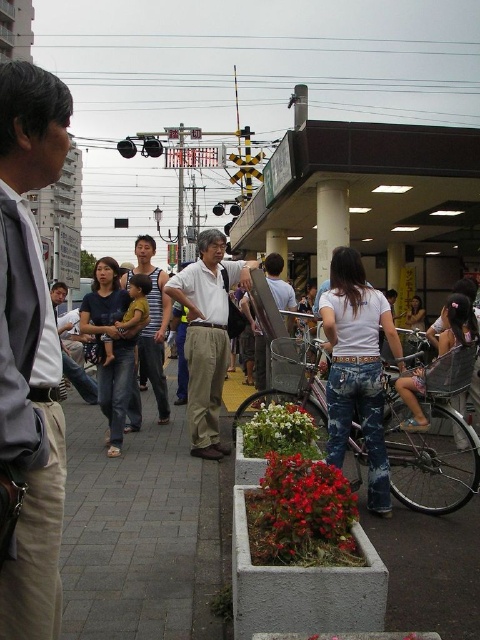
Question: Does khaki pants at left appear over matte black tank top at center?

Choices:
 (A) no
 (B) yes

Answer: (B)

Question: Which point appears farthest from the camera in this image?

Choices:
 (A) (273, 282)
 (B) (152, 378)
 (C) (188, 403)

Answer: (A)

Question: Is matte khaki pants at center to the right of matte black tank top at center from the viewer's perspective?

Choices:
 (A) no
 (B) yes

Answer: (B)

Question: Which point is closer to the camera?

Choices:
 (A) (62, 502)
 (B) (154, 353)
 (C) (197, 461)
 (D) (288, 285)

Answer: (A)

Question: Which of the following is the closest to the observer?

Choices:
 (A) khaki pants at left
 (B) matte khaki pants at center
 (C) gray concrete pavement at center

Answer: (A)

Question: Is gray concrete pavement at center above khaki pants at left?

Choices:
 (A) yes
 (B) no

Answer: (B)